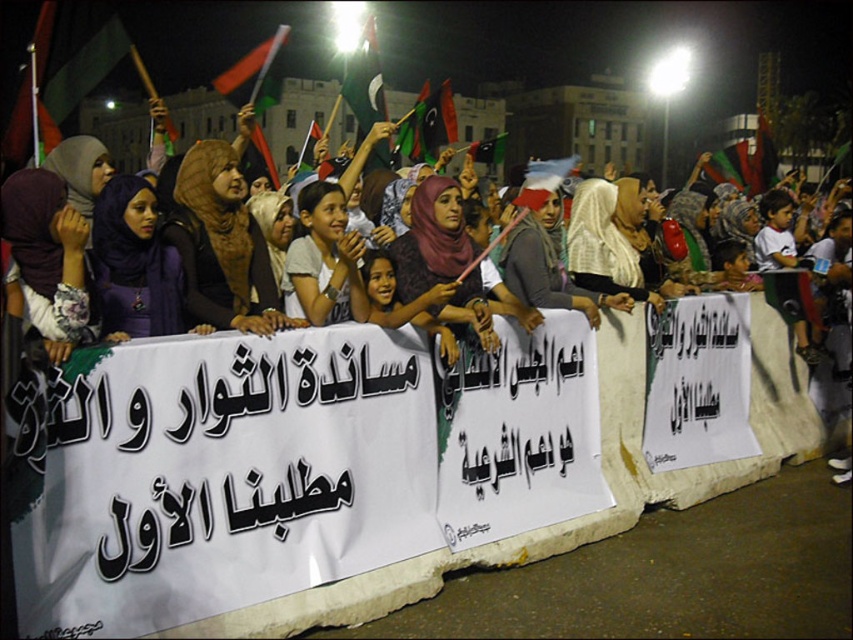
Question: Is brown fabric hijab at center thinner than white fabric banner at center?

Choices:
 (A) no
 (B) yes

Answer: (B)

Question: Which point is closer to the camera?

Choices:
 (A) (285, 269)
 (B) (180, 316)
 (C) (183, 182)
 (D) (593, 307)

Answer: (B)

Question: Which point is farther to the camera?

Choices:
 (A) (338, 227)
 (B) (96, 262)

Answer: (A)

Question: Does purple matte hijab at center appear under white fabric banner at center?

Choices:
 (A) yes
 (B) no

Answer: (A)

Question: Which point appears closest to the camera in this image?

Choices:
 (A) (218, 198)
 (B) (94, 228)
 (C) (16, 172)

Answer: (C)

Question: Observing the image, what is the correct spatial positioning of brown fabric hijab at center in reference to white fabric banner at center?

Choices:
 (A) below
 (B) above

Answer: (A)